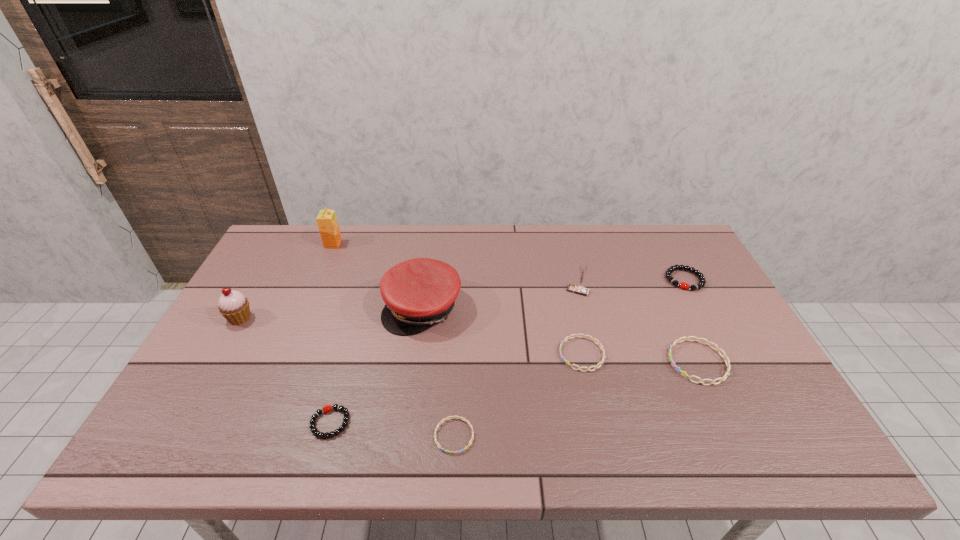
What are the coordinates of `the farthest object` in the screenshot? It's located at (327, 223).

Identify the location of the second object from left to right. This screenshot has width=960, height=540. (327, 223).

At what (x,y) coordinates should I click in order to perform the action: click on matchbox. Please return your answer as a coordinate pair (x, y). The height and width of the screenshot is (540, 960). Looking at the image, I should click on (583, 267).

Where is `the leftmost object`? the leftmost object is located at coordinates (233, 305).

In order to click on red cap in this screenshot , I will do `click(421, 292)`.

Where is `the rightmost blue bracelet`? This screenshot has height=540, width=960. the rightmost blue bracelet is located at coordinates (724, 356).

Locate an element on the screen. the bigger black bracelet is located at coordinates (670, 270).

Where is `the farthest bracelet`? This screenshot has width=960, height=540. the farthest bracelet is located at coordinates (670, 270).

Where is `the second blue bracelet from right to left`? The image size is (960, 540). the second blue bracelet from right to left is located at coordinates (568, 337).

This screenshot has height=540, width=960. Find the location of `the third bracelet from right to left`. the third bracelet from right to left is located at coordinates (568, 337).